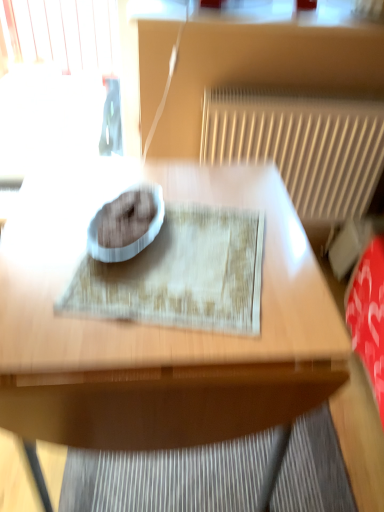
Question: Based on their positions, is wooden table at center located to the left or right of textured beige mat at center?

Choices:
 (A) right
 (B) left

Answer: (B)

Question: From their relative heights in the image, would you say wooden table at center is taller or shorter than textured beige mat at center?

Choices:
 (A) short
 (B) tall

Answer: (B)

Question: Which object is positioned closest to the white textured radiator at upper right?

Choices:
 (A) wooden table at center
 (B) textured beige mat at center

Answer: (A)

Question: Estimate the real-world distances between objects in this image. Which object is closer to the wooden table at center?

Choices:
 (A) white textured radiator at upper right
 (B) textured beige mat at center

Answer: (B)